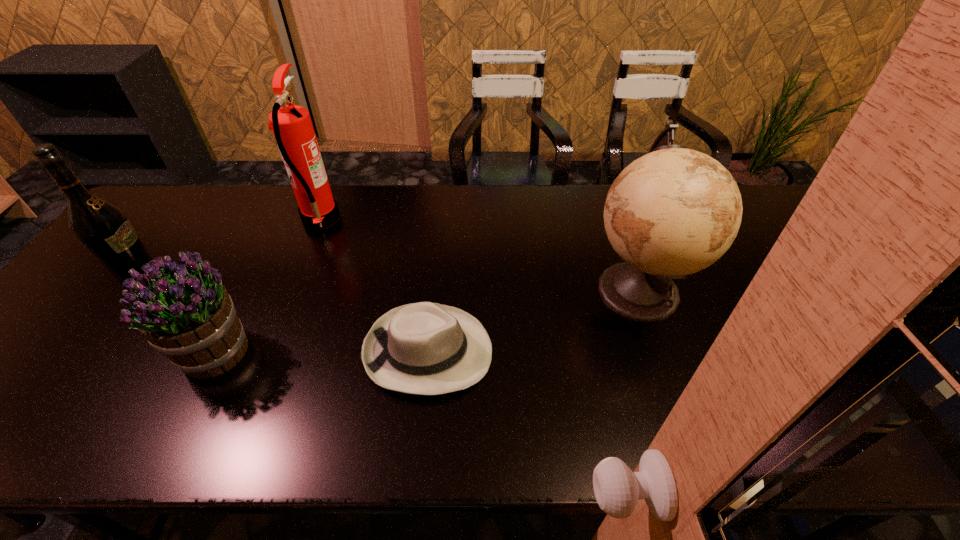
Where is `the farthest object`? The width and height of the screenshot is (960, 540). the farthest object is located at coordinates (291, 124).

Where is `the rightmost object`? the rightmost object is located at coordinates (675, 211).

The height and width of the screenshot is (540, 960). I want to click on wine bottle, so click(x=101, y=226).

Locate an element on the screen. The image size is (960, 540). the fourth tallest object is located at coordinates (186, 313).

At what (x,y) coordinates should I click in order to perform the action: click on fedora. Please return your answer as a coordinate pair (x, y). The height and width of the screenshot is (540, 960). Looking at the image, I should click on (424, 348).

At what (x,y) coordinates should I click in order to perform the action: click on the fourth object from left to right. Please return your answer as a coordinate pair (x, y). This screenshot has height=540, width=960. Looking at the image, I should click on (424, 348).

What are the coordinates of `vacant space situated 0.400m with the nozzle aimed from the fire extinguisher` in the screenshot? It's located at (466, 219).

Locate an element on the screen. This screenshot has height=540, width=960. free location located 0.050m on the front-facing side of the globe is located at coordinates (565, 289).

Locate an element on the screen. blank space located on the front-facing side of the globe is located at coordinates tap(565, 289).

Identify the location of blank space located on the front-facing side of the globe. The height and width of the screenshot is (540, 960). (547, 289).